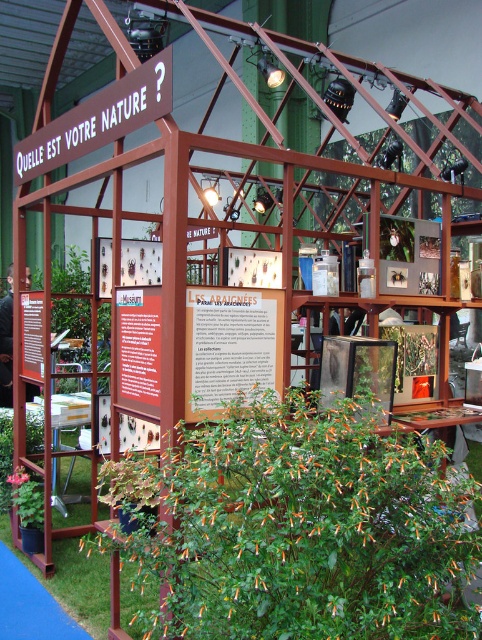
Question: Which point is closer to the camera?

Choices:
 (A) (29, 518)
 (B) (200, 346)

Answer: (B)

Question: Among these objects, which one is farthest from the camera?

Choices:
 (A) green leafy plant at lower center
 (B) wooden sign at center

Answer: (B)

Question: Is green leafy plant at lower center to the left of green leafy plant at lower left from the viewer's perspective?

Choices:
 (A) no
 (B) yes

Answer: (A)

Question: Is green leafy plant at lower center further to the viewer compared to green leafy plant at lower left?

Choices:
 (A) no
 (B) yes

Answer: (A)

Question: Which point is closer to the camera?

Choices:
 (A) (19, 472)
 (B) (310, 454)
 (C) (199, 412)

Answer: (B)

Question: Can you confirm if green leafy plant at lower center is thinner than green leafy plant at lower left?

Choices:
 (A) no
 (B) yes

Answer: (A)